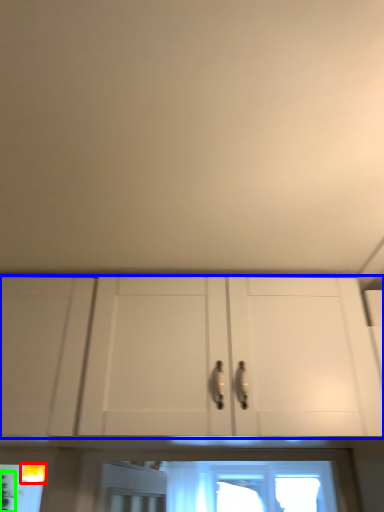
Question: Which is nearer to the light fixture (highlighted by a red box)? cabinetry (highlighted by a blue box) or plant (highlighted by a green box).

Choices:
 (A) cabinetry
 (B) plant

Answer: (B)